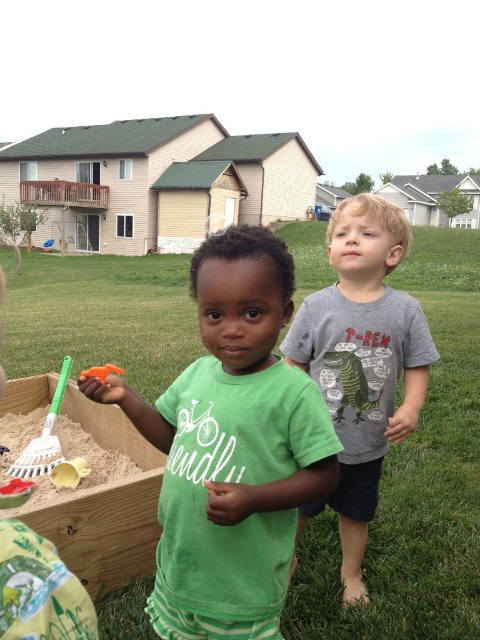
You are a parent trying to choose between two items to give to your child for a playdate. You have the green matte shirt at center and the orange plastic shovel at lower left. Which item is bigger?

The green matte shirt at center is larger than the orange plastic shovel at lower left.

You are a parent trying to organize the sandbox. You have to decide whether to place the orange plastic shovel at lower left into a storage container that can only hold items smaller than the smooth yellow sand at lower left. Based on the scene, will the shovel fit?

The smooth yellow sand at lower left is larger in size than the orange plastic shovel at lower left. Therefore, the orange plastic shovel at lower left is smaller than the sand, so it will fit into the container.